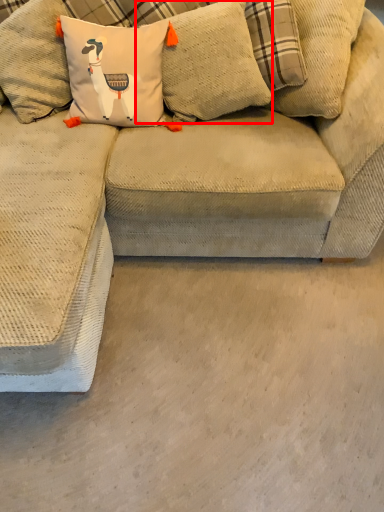
Question: From the image, what is the correct spatial relationship of pillow (annotated by the red box) in relation to concrete?

Choices:
 (A) left
 (B) right

Answer: (A)